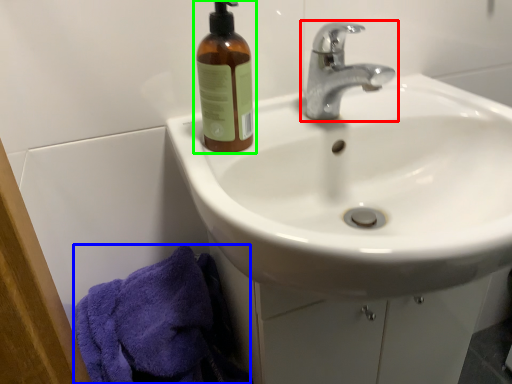
Question: Which object is the farthest from tap (highlighted by a red box)? Choose among these: bath towel (highlighted by a blue box) or bottle (highlighted by a green box).

Choices:
 (A) bath towel
 (B) bottle

Answer: (A)